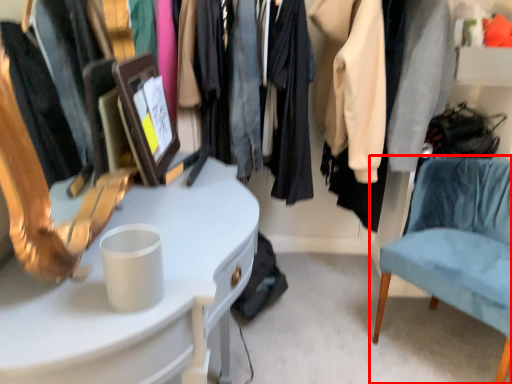
Question: From the image's perspective, what is the correct spatial relationship of chair (annotated by the red box) in relation to desk?

Choices:
 (A) above
 (B) below

Answer: (A)